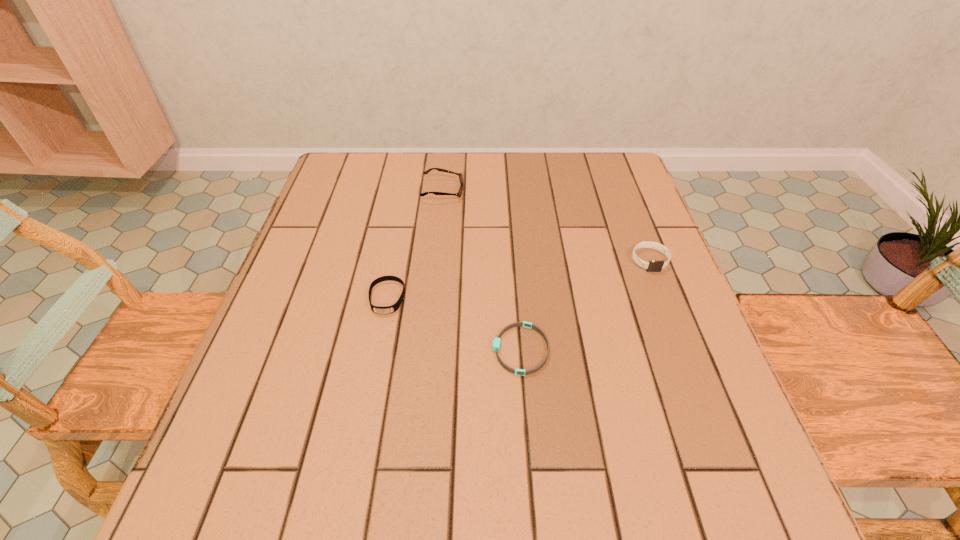
The height and width of the screenshot is (540, 960). Identify the location of free space at the far right corner of the desktop. click(637, 191).

Where is `vacant space in between the tallest object and the second wristband from right to left`? vacant space in between the tallest object and the second wristband from right to left is located at coordinates (482, 270).

The image size is (960, 540). Identify the location of vacant area that lies between the third farthest object and the third nearest object. (518, 279).

Identify the location of unoccupied area between the leftmost object and the tallest object. The height and width of the screenshot is (540, 960). (415, 244).

Locate an element on the screen. This screenshot has width=960, height=540. free space between the nearest object and the leftmost wristband is located at coordinates (454, 323).

Identify the location of vacant region between the farthest object and the leftmost wristband. (415, 244).

Identify the location of vacant area between the farthest object and the third tallest object. The width and height of the screenshot is (960, 540). (415, 244).

Locate an element on the screen. The image size is (960, 540). empty space between the farthest object and the nearest wristband is located at coordinates (482, 270).

The height and width of the screenshot is (540, 960). What are the coordinates of `free space between the leftmost wristband and the rightmost object` in the screenshot? It's located at (518, 279).

The image size is (960, 540). I want to click on free space between the second shortest wristband and the nearest object, so click(x=454, y=323).